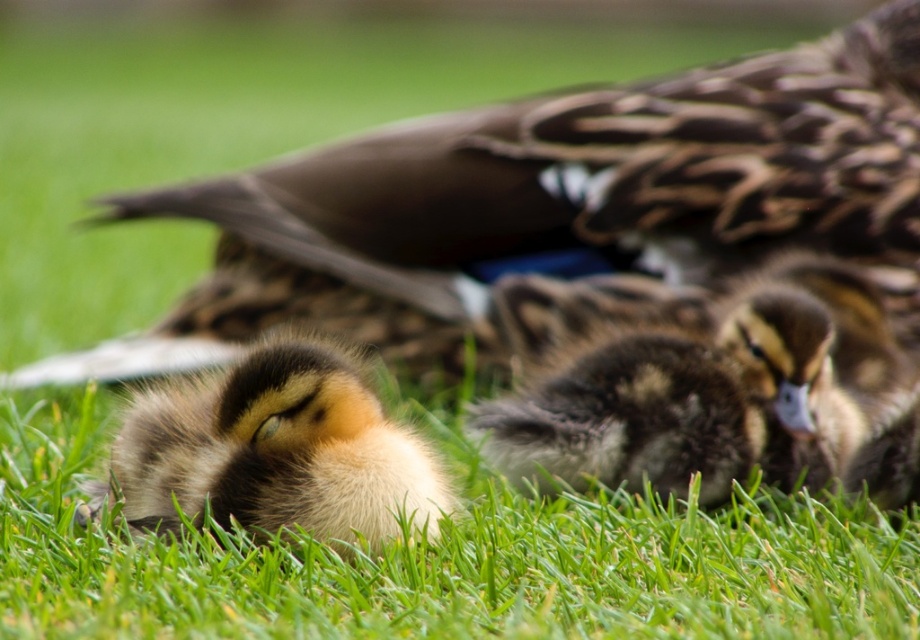
Based on the photo, who is shorter, brown fluffy duckling at center or soft brown downy duckling at lower left?

soft brown downy duckling at lower left

Between brown fluffy duckling at center and soft brown downy duckling at lower left, which one appears on the left side from the viewer's perspective?

soft brown downy duckling at lower left

At what (x,y) coordinates should I click in order to perform the action: click on brown fluffy duckling at center. Please return your answer as a coordinate pair (x, y). Looking at the image, I should click on (725, 396).